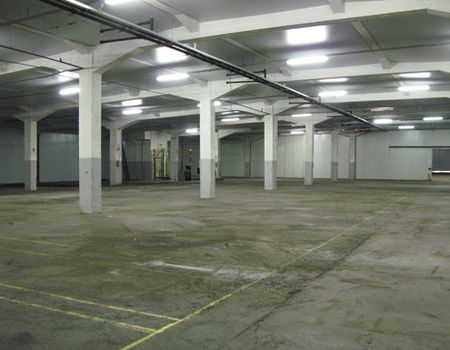
Find the location of a particular element. column is located at coordinates (90, 132).